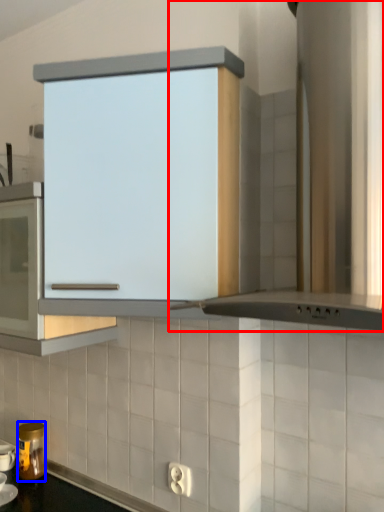
Question: Which object is closer to the camera taking this photo, home appliance (highlighted by a red box) or kitchen appliance (highlighted by a blue box)?

Choices:
 (A) home appliance
 (B) kitchen appliance

Answer: (A)